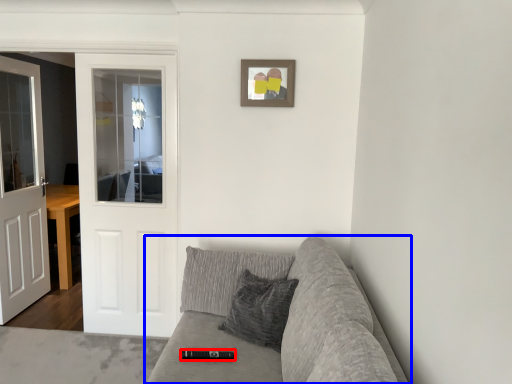
Question: Which point is closer to the camera, remote (highlighted by a red box) or studio couch (highlighted by a blue box)?

Choices:
 (A) remote
 (B) studio couch

Answer: (B)